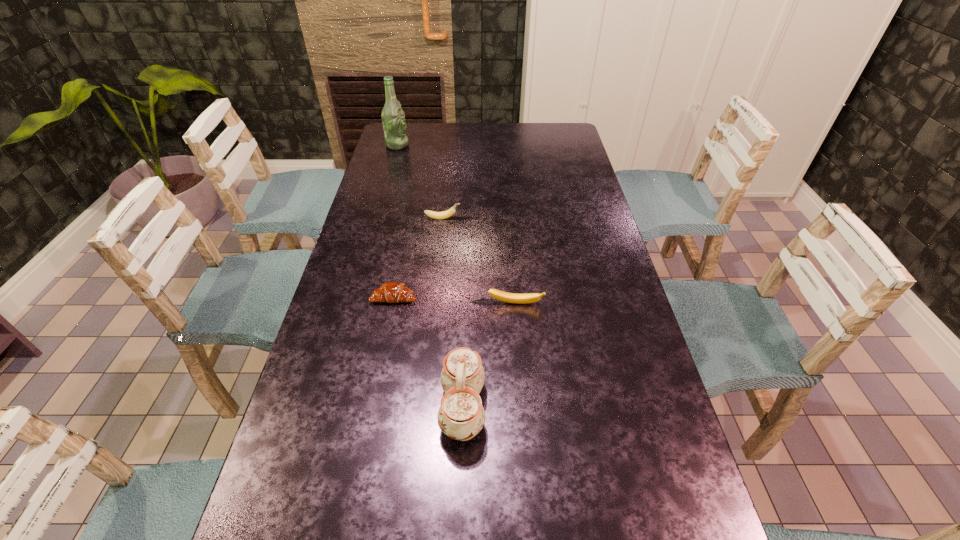
What are the coordinates of `vacant area that lies between the shortest object and the chinaware` in the screenshot? It's located at (428, 352).

Where is `free space between the fourth shortest object and the right banana`? The image size is (960, 540). free space between the fourth shortest object and the right banana is located at coordinates (489, 355).

Locate an element on the screen. The image size is (960, 540). object that ranks as the closest to the tallest object is located at coordinates (445, 214).

This screenshot has height=540, width=960. In order to click on object that stands as the second closest to the beer bottle in this screenshot , I will do `click(391, 292)`.

Where is `free spot that satisfies the following two spatial constraints: 1. on the back side of the shortest object; 2. on the surface of the farthest object`? The width and height of the screenshot is (960, 540). free spot that satisfies the following two spatial constraints: 1. on the back side of the shortest object; 2. on the surface of the farthest object is located at coordinates (423, 145).